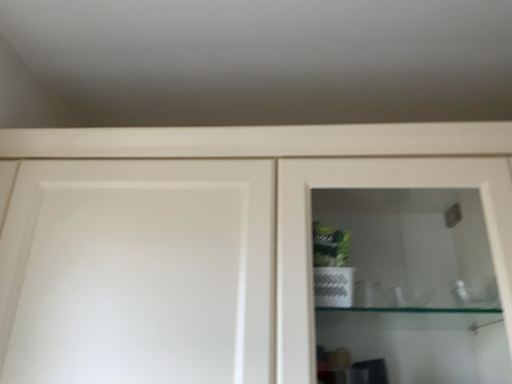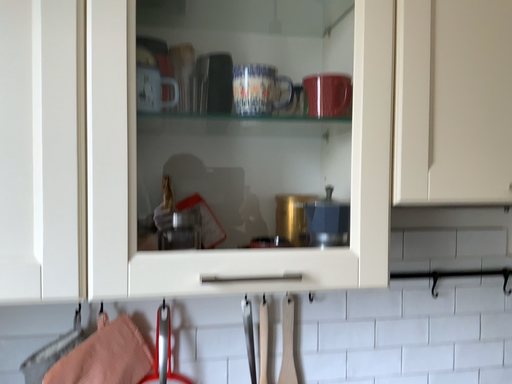
Question: Which way did the camera rotate in the video?

Choices:
 (A) rotated right
 (B) rotated left

Answer: (A)